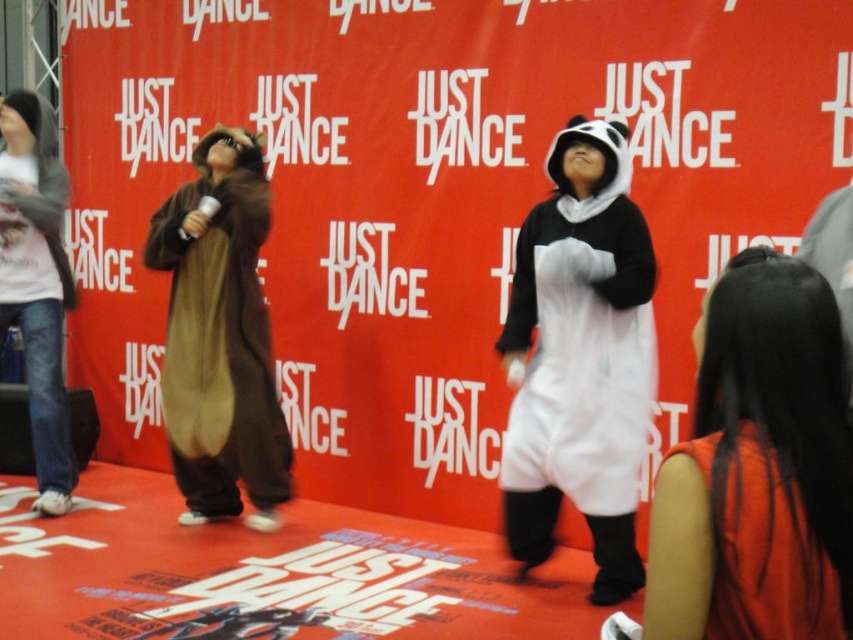
You are at the Just Dance promotional event and see the white plush panda at center and the jeans at left. Which object is positioned to the right of the other?

The white plush panda at center is to the right of the jeans at left.

You are a photographer at the event and want to capture a photo of the silky orange dress at lower right. Based on its position, where should you aim your camera relative to the stage?

The silky orange dress at lower right is located at coordinates approximately 0.739 on the x axis and 0.890 on the y axis, so you should aim your camera towards the lower right area of the stage to capture it.

You are a photographer at the Just Dance event. You want to take a photo that includes both the silky orange dress at lower right and the white plush panda at center. The minimum distance required between the two subjects for your camera to focus properly is 2 meters. Can you capture both subjects in focus with your current setup?

The silky orange dress at lower right and the white plush panda at center are 1.87 meters apart, which is less than the required 2 meters. Therefore, you cannot capture both subjects in focus with your current setup.